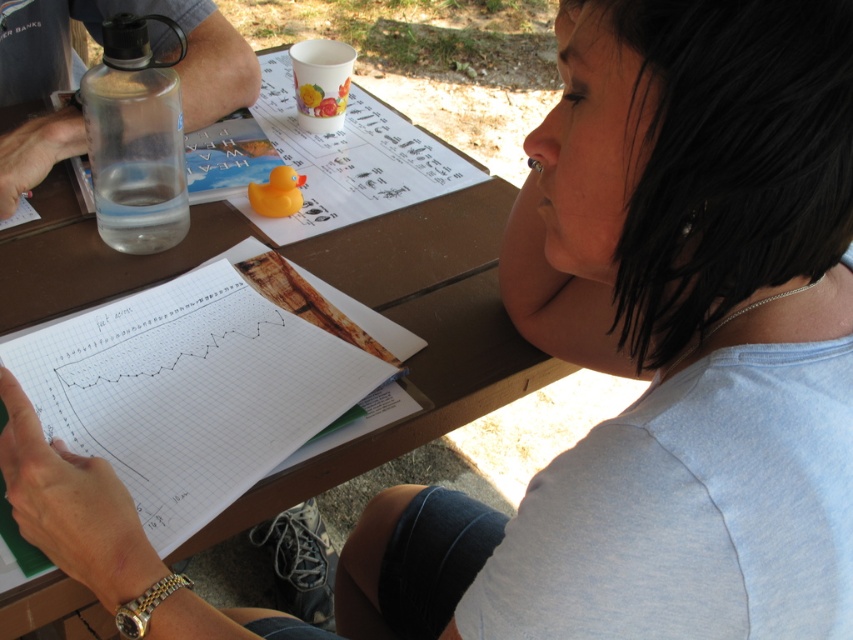
Question: Based on their relative distances, which object is farther from the brown wooden picnic table at center?

Choices:
 (A) transparent plastic water bottle at left
 (B) white grid paper at center

Answer: (A)

Question: Does brown wooden picnic table at center appear on the left side of transparent plastic water bottle at left?

Choices:
 (A) yes
 (B) no

Answer: (B)

Question: Can you confirm if white grid paper at center is positioned to the right of transparent plastic water bottle at left?

Choices:
 (A) no
 (B) yes

Answer: (B)

Question: Among these points, which one is nearest to the camera?

Choices:
 (A) (462, 192)
 (B) (7, 522)

Answer: (B)

Question: Can you confirm if white grid paper at center is bigger than transparent plastic water bottle at left?

Choices:
 (A) no
 (B) yes

Answer: (B)

Question: Which point is farther to the camera?

Choices:
 (A) brown wooden picnic table at center
 (B) white grid paper at center
 (C) transparent plastic water bottle at left

Answer: (C)